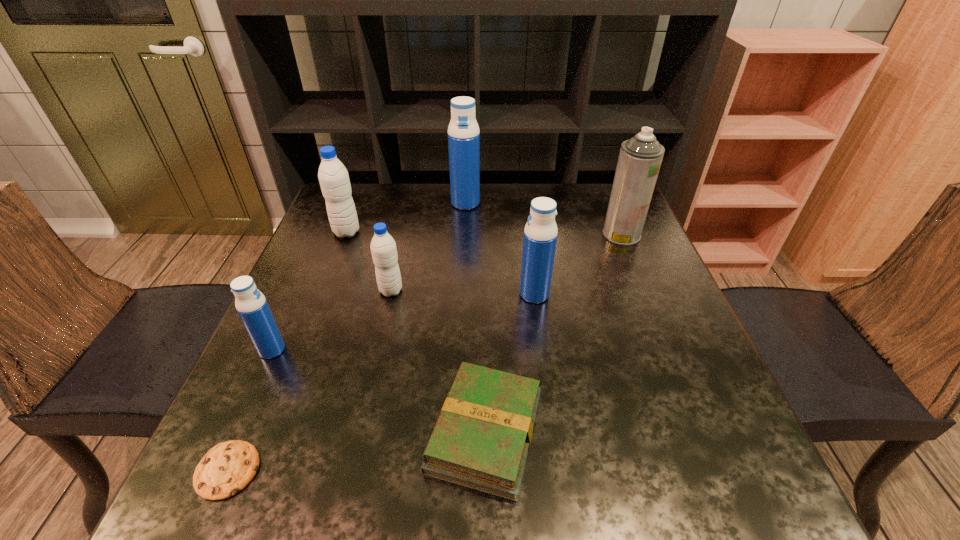
Where is `free space at the far edge`? Image resolution: width=960 pixels, height=540 pixels. free space at the far edge is located at coordinates (468, 218).

This screenshot has height=540, width=960. Find the location of `vacant space at the near edge of the desktop`. vacant space at the near edge of the desktop is located at coordinates coord(411,460).

In the image, there is a desktop. In order to click on vacant region at the left edge in this screenshot , I will do `click(353, 269)`.

Identify the location of vacant space at the right edge of the desktop. The height and width of the screenshot is (540, 960). (649, 256).

Locate an element on the screen. The width and height of the screenshot is (960, 540). vacant space at the near right corner of the desktop is located at coordinates (758, 462).

At what (x,y) coordinates should I click in order to perform the action: click on blank region between the yellow book and the aerosol can. Please return your answer as a coordinate pair (x, y). Image resolution: width=960 pixels, height=540 pixels. Looking at the image, I should click on (x=553, y=333).

The image size is (960, 540). Find the location of `free space between the shortest object and the rightmost water bottle`. free space between the shortest object and the rightmost water bottle is located at coordinates (381, 382).

This screenshot has width=960, height=540. I want to click on vacant space that's between the rightmost object and the right gray water bottle, so [506, 262].

Find the location of a particular element. Image resolution: width=960 pixels, height=540 pixels. vacant area that lies between the yellow book and the farther gray water bottle is located at coordinates [416, 332].

This screenshot has width=960, height=540. I want to click on free spot between the bigger gray water bottle and the yellow book, so click(x=416, y=332).